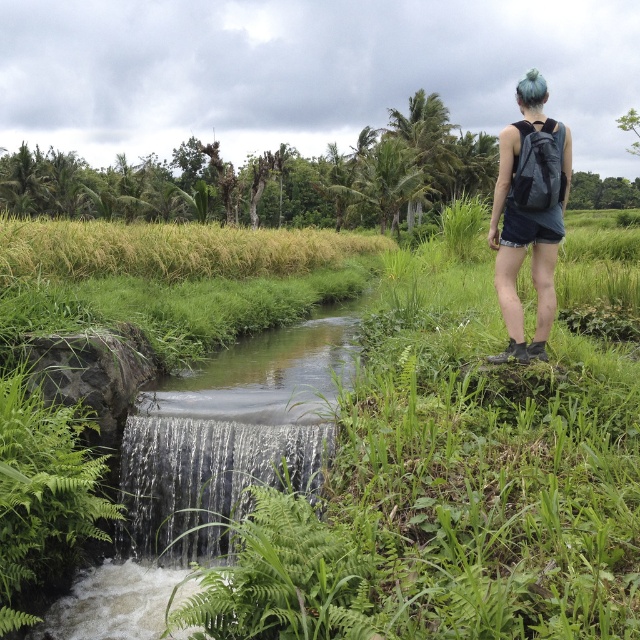
In the scene shown: You are the person in the scene and want to fill your matte gray backpack at upper right with water from the clear water cascade at lower left. Can you reach the water without moving your backpack?

The clear water cascade at lower left has a lesser height compared to the matte gray backpack at upper right. Since the backpack is taller, you can easily reach the water from the cascade without needing to move the backpack.

You are a hiker who wants to place your matte gray backpack at upper right on the ground. Which direction should you move it to place it on the green grass at upper left?

The green grass at upper left is above matte gray backpack at upper right, so you should move the matte gray backpack at upper right towards the upper left direction to place it on the green grass at upper left.

You are planning to place a small decorative rock between the green grass at upper left and the matte gray backpack at upper right. Based on the scene, which object should the rock be closer to if you want it to be near the wider area?

The green grass at upper left is wider than the matte gray backpack at upper right, so the rock should be placed closer to the green grass at upper left to be near the wider area.